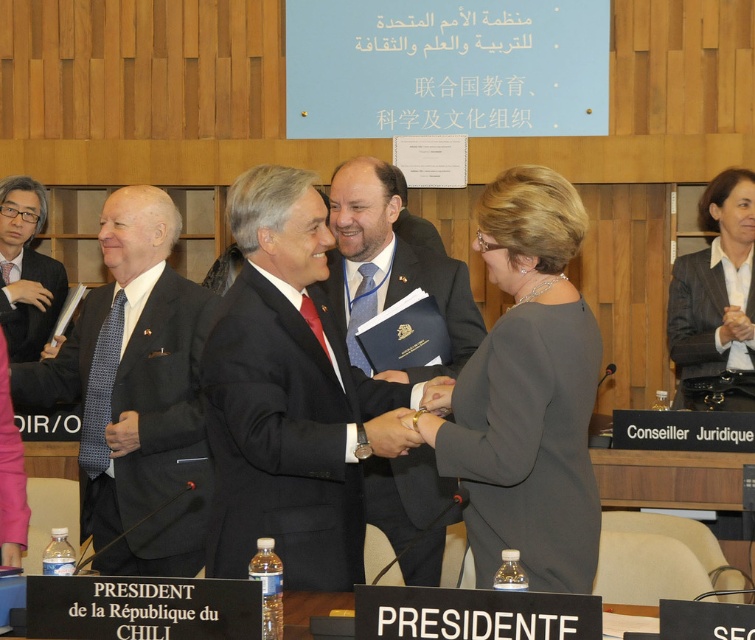
Can you confirm if black satin business suit at right is taller than dark gray suit at left?

Yes.

Who is lower down, black satin business suit at right or dark gray suit at left?

Positioned lower is black satin business suit at right.

Measure the distance between point (680,396) and camera.

Point (680,396) and camera are 5.81 meters apart from each other.

Locate an element on the screen. black satin business suit at right is located at coordinates (695, 316).

Does point (248, 289) come closer to viewer compared to point (461, 330)?

Yes.

Between point (282, 406) and point (405, 262), which one is positioned behind?

Point (405, 262)

Between point (207, 390) and point (464, 316), which one is positioned behind?

The point (464, 316) is behind.

Locate an element on the screen. black satin suit at center is located at coordinates (285, 436).

Does dark gray wool suit at left appear under dark gray suit at left?

Correct, dark gray wool suit at left is located below dark gray suit at left.

Who is more distant from viewer, (211, 480) or (5, 332)?

The point (5, 332) is behind.

Image resolution: width=755 pixels, height=640 pixels. Identify the location of dark gray wool suit at left. (156, 433).